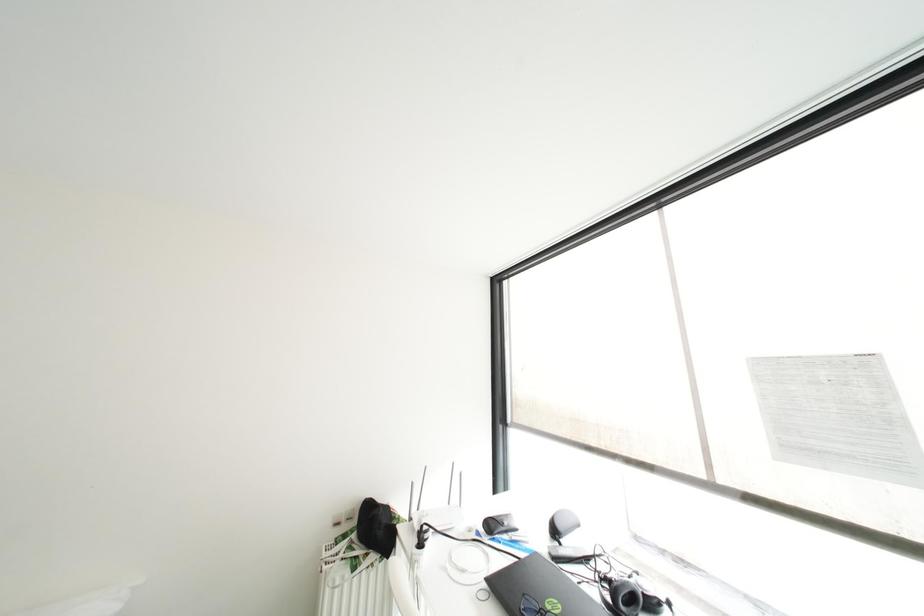
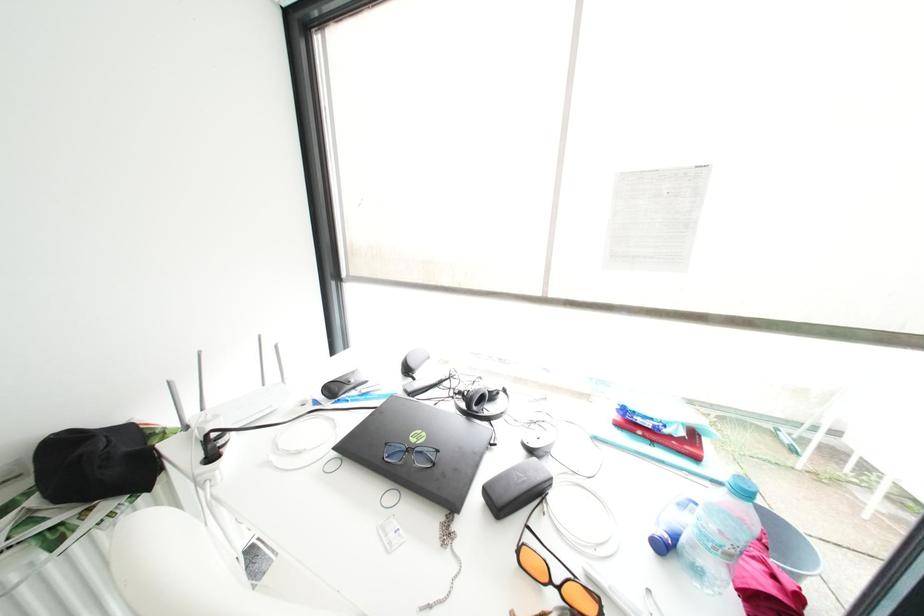
How did the camera likely rotate?

The camera's rotation is toward right-down.